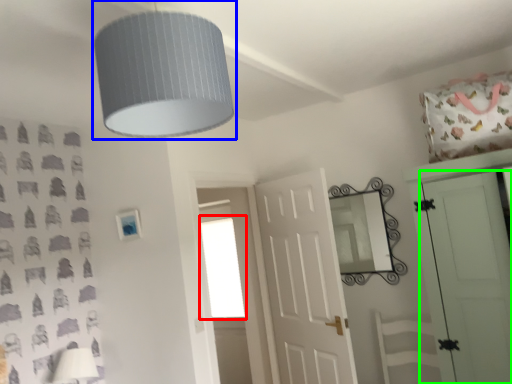
Question: Which object is positioned farthest from window (highlighted by a red box)? Select from lamp (highlighted by a blue box) and door (highlighted by a green box).

Choices:
 (A) lamp
 (B) door

Answer: (A)